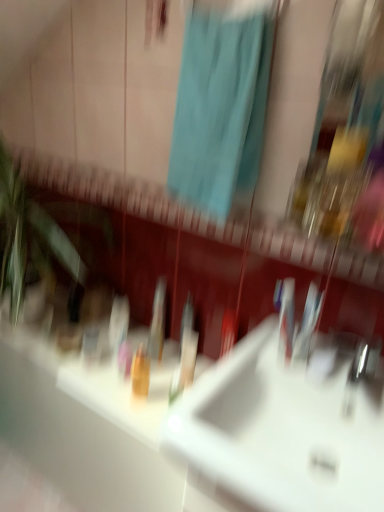
In order to face teal fabric shower curtain at upper center, should I rotate leftwards or rightwards?

A 2.302 degree turn to the right will do.

This screenshot has width=384, height=512. What do you see at coordinates (140, 373) in the screenshot?
I see `translucent orange bottle at center` at bounding box center [140, 373].

Measure the distance between point (x=146, y=387) and camera.

Point (x=146, y=387) and camera are 3.96 feet apart.

This screenshot has width=384, height=512. Describe the element at coordinates (185, 352) in the screenshot. I see `translucent plastic toothbrush at center` at that location.

Locate an element on the screen. The width and height of the screenshot is (384, 512). teal fabric shower curtain at upper center is located at coordinates (220, 109).

From a real-world perspective, does translucent plastic toothbrush at center stand above white glossy sink at center?

Actually, translucent plastic toothbrush at center is physically below white glossy sink at center in the real world.

In the scene shown: Considering the sizes of objects translucent plastic toothbrush at center and white glossy sink at center in the image provided, who is smaller, translucent plastic toothbrush at center or white glossy sink at center?

With smaller size is translucent plastic toothbrush at center.

Can white glossy sink at center be found inside translucent plastic toothbrush at center?

That's incorrect, white glossy sink at center is not inside translucent plastic toothbrush at center.

Locate an element on the screen. This screenshot has width=384, height=512. sink on the right side of translucent plastic toothbrush at center is located at coordinates (280, 432).

Does point (143, 379) lie in front of point (291, 362)?

That is False.

Can you tell me how much translucent orange bottle at center and white glossy sink at center differ in facing direction?

The facing directions of translucent orange bottle at center and white glossy sink at center are 0.505 degrees apart.

Which is more to the right, translucent orange bottle at center or white glossy sink at center?

From the viewer's perspective, white glossy sink at center appears more on the right side.

From a real-world perspective, is translucent orange bottle at center positioned under white glossy sink at center based on gravity?

Indeed, from a real-world perspective, translucent orange bottle at center is positioned beneath white glossy sink at center.

Considering the relative sizes of translucent orange bottle at center and teal fabric shower curtain at upper center in the image provided, is translucent orange bottle at center thinner than teal fabric shower curtain at upper center?

Indeed, translucent orange bottle at center has a lesser width compared to teal fabric shower curtain at upper center.

Relative to teal fabric shower curtain at upper center, is translucent orange bottle at center in front or behind?

translucent orange bottle at center is behind teal fabric shower curtain at upper center.

Considering the positions of objects translucent orange bottle at center and teal fabric shower curtain at upper center in the image provided, who is more to the left, translucent orange bottle at center or teal fabric shower curtain at upper center?

From the viewer's perspective, translucent orange bottle at center appears more on the left side.

What's the angular difference between teal fabric shower curtain at upper center and white glossy sink at center's facing directions?

The facing directions of teal fabric shower curtain at upper center and white glossy sink at center are 0.433 degrees apart.

In the scene shown: Is teal fabric shower curtain at upper center inside the boundaries of white glossy sink at center, or outside?

teal fabric shower curtain at upper center is located beyond the bounds of white glossy sink at center.

Which is nearer, (222,160) or (273,480)?

Point (222,160) is farther from the camera than point (273,480).

Can translucent orange bottle at center be found inside white glossy sink at center?

No, white glossy sink at center does not contain translucent orange bottle at center.

Visually, is white glossy sink at center positioned to the left or to the right of translucent orange bottle at center?

Clearly, white glossy sink at center is on the right of translucent orange bottle at center in the image.

Is white glossy sink at center far away from translucent orange bottle at center?

No.

Considering the sizes of objects white glossy sink at center and translucent orange bottle at center in the image provided, who is smaller, white glossy sink at center or translucent orange bottle at center?

Smaller between the two is translucent orange bottle at center.

Can you confirm if white glossy sink at center is wider than translucent plastic toothbrush at center?

Indeed, white glossy sink at center has a greater width compared to translucent plastic toothbrush at center.

Does white glossy sink at center have a smaller size compared to translucent plastic toothbrush at center?

No, white glossy sink at center is not smaller than translucent plastic toothbrush at center.

Is white glossy sink at center further to camera compared to translucent plastic toothbrush at center?

No.

Find the location of a particular element. The height and width of the screenshot is (512, 384). sink located on the right of translucent plastic toothbrush at center is located at coordinates (280, 432).

How different are the orientations of translucent plastic toothbrush at center and teal fabric shower curtain at upper center in degrees?

0.0718 degrees separate the facing orientations of translucent plastic toothbrush at center and teal fabric shower curtain at upper center.

Does translucent plastic toothbrush at center have a lesser height compared to teal fabric shower curtain at upper center?

Yes.

Is point (190, 328) positioned before point (211, 215)?

No, it is behind (211, 215).

What are the coordinates of `sink below the translucent plastic toothbrush at center (from the image's perspective)` in the screenshot? It's located at (280, 432).

Find the location of a particular element. sink on the right of translucent orange bottle at center is located at coordinates (280, 432).

Looking at the image, which one is located further to white glossy sink at center, translucent orange bottle at center or teal fabric shower curtain at upper center?

teal fabric shower curtain at upper center lies further to white glossy sink at center than the other object.

When comparing their distances from white glossy sink at center, does translucent orange bottle at center or translucent plastic toothbrush at center seem closer?

translucent plastic toothbrush at center lies closer to white glossy sink at center than the other object.

Based on the photo, from the image, which object appears to be farther from teal fabric shower curtain at upper center, translucent orange bottle at center or white glossy sink at center?

Among the two, translucent orange bottle at center is located further to teal fabric shower curtain at upper center.

Considering their positions, is translucent plastic toothbrush at center positioned closer to translucent orange bottle at center than teal fabric shower curtain at upper center?

translucent plastic toothbrush at center is closer to translucent orange bottle at center.

Looking at the image, which one is located further to translucent plastic toothbrush at center, translucent orange bottle at center or white glossy sink at center?

The object further to translucent plastic toothbrush at center is white glossy sink at center.

Considering their positions, is translucent plastic toothbrush at center positioned further to translucent orange bottle at center than white glossy sink at center?

Among the two, white glossy sink at center is located further to translucent orange bottle at center.

Estimate the real-world distances between objects in this image. Which object is closer to translucent plastic toothbrush at center, teal fabric shower curtain at upper center or white glossy sink at center?

white glossy sink at center.

From the image, which object appears to be farther from white glossy sink at center, translucent plastic toothbrush at center or translucent orange bottle at center?

translucent orange bottle at center.

The height and width of the screenshot is (512, 384). Identify the location of toothbrush between teal fabric shower curtain at upper center and translucent orange bottle at center from top to bottom. (185, 352).

Locate an element on the screen. Image resolution: width=384 pixels, height=512 pixels. toiletry located between white glossy sink at center and translucent plastic toothbrush at center in the depth direction is located at coordinates (140, 373).

Where is `shower curtain between white glossy sink at center and translucent plastic toothbrush at center in the front-back direction`? shower curtain between white glossy sink at center and translucent plastic toothbrush at center in the front-back direction is located at coordinates (220, 109).

I want to click on sink between teal fabric shower curtain at upper center and translucent orange bottle at center vertically, so click(280, 432).